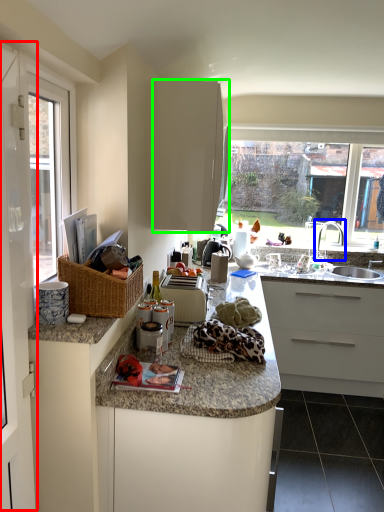
Question: Which object is the farthest from screen door (highlighted by a red box)? Choose among these: tap (highlighted by a blue box) or cabinetry (highlighted by a green box).

Choices:
 (A) tap
 (B) cabinetry

Answer: (A)